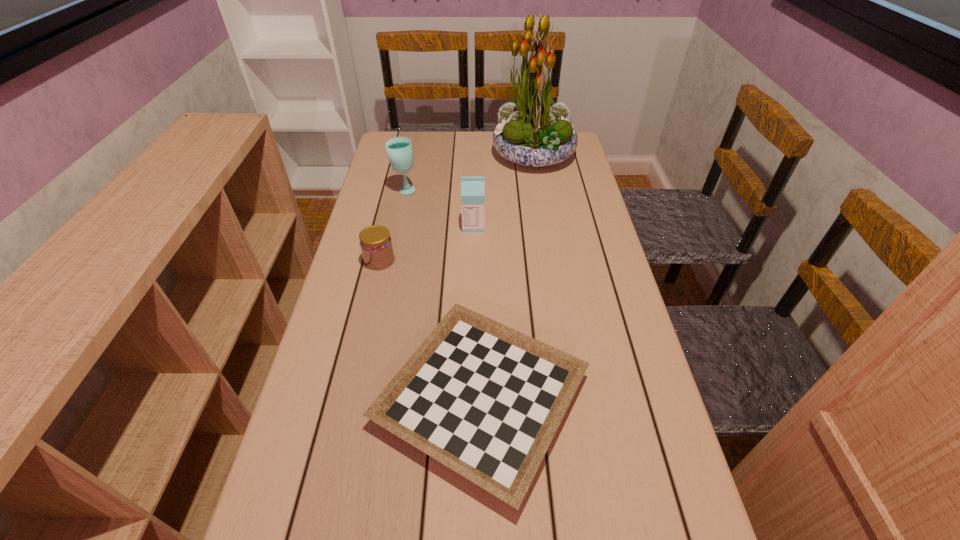
The height and width of the screenshot is (540, 960). Find the location of `object positioned at the far right corner`. object positioned at the far right corner is located at coordinates (532, 131).

What are the coordinates of `free space at the far edge` in the screenshot? It's located at (431, 135).

Find the location of a particular element. Image resolution: width=960 pixels, height=540 pixels. free region at the left edge is located at coordinates (389, 307).

Image resolution: width=960 pixels, height=540 pixels. In the image, there is a desktop. In order to click on vacant space at the right edge in this screenshot , I will do [x=581, y=212].

Where is `empty space that is in between the glass and the third farthest object`? empty space that is in between the glass and the third farthest object is located at coordinates (439, 208).

Where is `unoccupied area between the third farthest object and the flower arrangement`? The width and height of the screenshot is (960, 540). unoccupied area between the third farthest object and the flower arrangement is located at coordinates (503, 191).

In order to click on free space between the third farthest object and the glass in this screenshot , I will do `click(439, 208)`.

The height and width of the screenshot is (540, 960). I want to click on free space between the third farthest object and the second nearest object, so click(x=426, y=243).

At what (x,y) coordinates should I click in order to perform the action: click on unoccupied area between the jam and the third nearest object. Please return your answer as a coordinate pair (x, y). Looking at the image, I should click on (426, 243).

The width and height of the screenshot is (960, 540). I want to click on empty location between the flower arrangement and the second nearest object, so click(x=457, y=208).